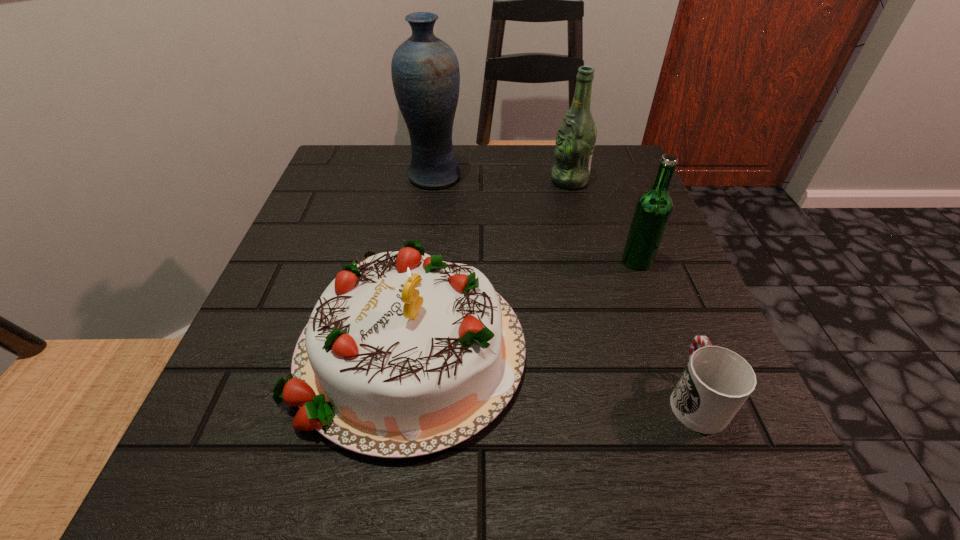
Identify the location of vacant space that satisfies the following two spatial constraints: 1. on the surface of the farther beer bottle; 2. on the handle side of the shortest object. (628, 397).

Identify the location of vacant space that satisfies the following two spatial constraints: 1. on the surface of the shorter beer bottle; 2. on the left side of the left beer bottle. 591,260.

Find the location of a particular element. This screenshot has width=960, height=540. free point that satisfies the following two spatial constraints: 1. on the handle side of the shortest object; 2. on the surface of the third object from left to right is located at coordinates (610, 181).

What are the coordinates of `vacant space that satisfies the following two spatial constraints: 1. on the handle side of the cup; 2. on the surface of the left beer bottle` in the screenshot? It's located at (610, 181).

You are a GUI agent. You are given a task and a screenshot of the screen. Output one action in this format:
    pyautogui.click(x=<x>, y=<y>)
    Task: Click on the vacant position in the image that satisfies the following two spatial constraints: 1. on the surface of the left beer bottle; 2. on the handle side of the cup
    This screenshot has width=960, height=540.
    Given the screenshot: What is the action you would take?
    pyautogui.click(x=628, y=397)

Locate an element on the screen. This screenshot has height=540, width=960. free region that satisfies the following two spatial constraints: 1. on the surface of the farther beer bottle; 2. on the handle side of the cup is located at coordinates (628, 397).

Identify the location of vacant point that satisfies the following two spatial constraints: 1. on the surface of the third object from right to left; 2. on the handle side of the cup. (628, 397).